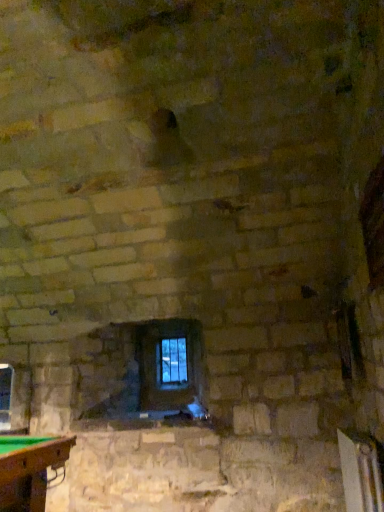
Image resolution: width=384 pixels, height=512 pixels. What do you see at coordinates (171, 362) in the screenshot? I see `clear glass window at center` at bounding box center [171, 362].

At what (x,y) coordinates should I click in order to perform the action: click on clear glass window at center. Please return your answer as a coordinate pair (x, y). Looking at the image, I should click on (171, 362).

What is the approximate width of clear glass window at center?

3.16 inches.

At what (x,y) coordinates should I click in order to perform the action: click on clear glass window at center. Please return your answer as a coordinate pair (x, y). Looking at the image, I should click on coord(171,362).